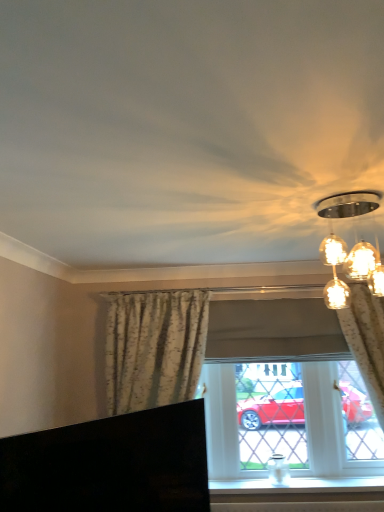
Question: Relative to white smooth window sill at lower center, is matte floral curtains at center in front or behind?

Choices:
 (A) front
 (B) behind

Answer: (B)

Question: Which is correct: matte floral curtains at center is inside white smooth window sill at lower center, or outside of it?

Choices:
 (A) outside
 (B) inside

Answer: (A)

Question: Estimate the real-world distances between objects in this image. Which object is closer to the floral fabric curtain at center, the 2th curtain in the right-to-left sequence?

Choices:
 (A) black glossy tv at lower left
 (B) matte glass light fixture at upper right
 (C) white smooth window sill at lower center
 (D) matte floral curtains at center
 (E) floral fabric curtain at right, which is the second curtain in left-to-right order

Answer: (D)

Question: Which object is the farthest from the matte glass light fixture at upper right?

Choices:
 (A) matte floral curtains at center
 (B) white smooth window sill at lower center
 (C) floral fabric curtain at center, which ranks as the 1th curtain in left-to-right order
 (D) floral fabric curtain at right, the 1th curtain when ordered from right to left
 (E) black glossy tv at lower left

Answer: (B)